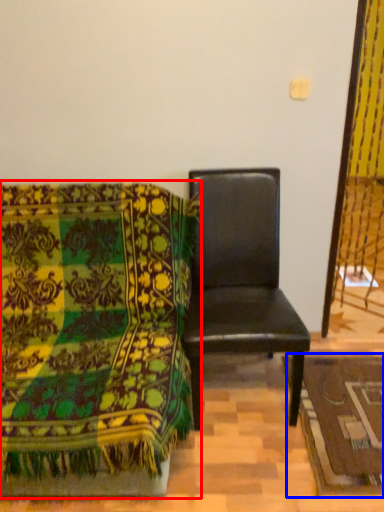
Question: Which of the following is the farthest to the observer, chair (highlighted by a red box) or mat (highlighted by a blue box)?

Choices:
 (A) chair
 (B) mat

Answer: (B)